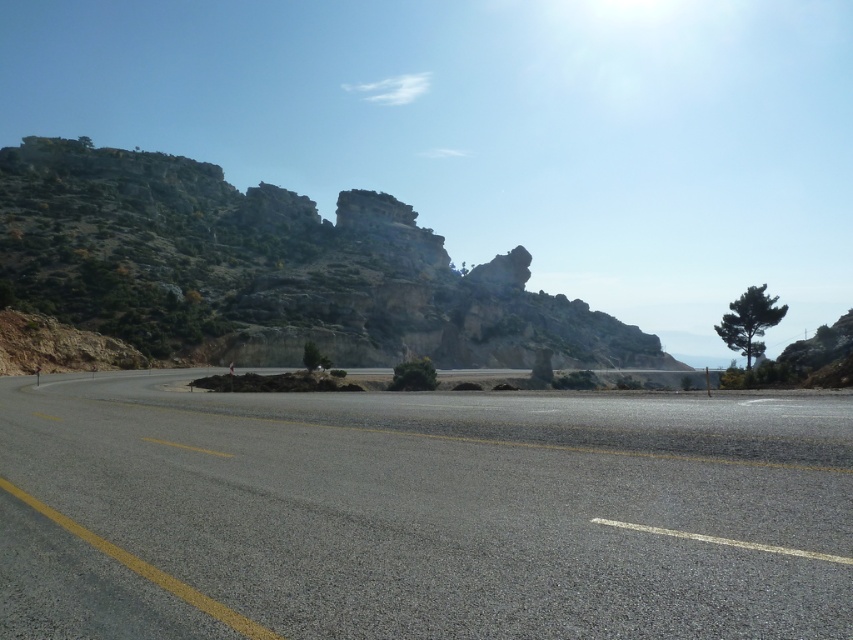
Question: Does asphalt road at center appear under brown rocky mountain at upper left?

Choices:
 (A) no
 (B) yes

Answer: (B)

Question: Can you confirm if asphalt road at center is bigger than brown rocky mountain at upper left?

Choices:
 (A) no
 (B) yes

Answer: (A)

Question: Which object appears farthest from the camera in this image?

Choices:
 (A) brown rocky mountain at upper left
 (B) asphalt road at center

Answer: (A)

Question: Is asphalt road at center smaller than brown rocky mountain at upper left?

Choices:
 (A) yes
 (B) no

Answer: (A)